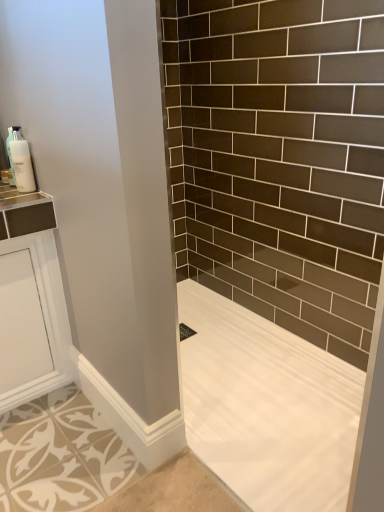
Question: Is white glossy soap dispenser at upper left located within white smooth bathtub at lower right?

Choices:
 (A) no
 (B) yes

Answer: (A)

Question: Is white smooth bathtub at lower right further to the viewer compared to white glossy soap dispenser at upper left?

Choices:
 (A) no
 (B) yes

Answer: (A)

Question: Can you confirm if white smooth bathtub at lower right is taller than white glossy soap dispenser at upper left?

Choices:
 (A) yes
 (B) no

Answer: (B)

Question: Is white smooth bathtub at lower right facing towards white glossy soap dispenser at upper left?

Choices:
 (A) no
 (B) yes

Answer: (A)

Question: From a real-world perspective, is white smooth bathtub at lower right below white glossy soap dispenser at upper left?

Choices:
 (A) yes
 (B) no

Answer: (A)

Question: Is white smooth bathtub at lower right oriented away from white glossy soap dispenser at upper left?

Choices:
 (A) no
 (B) yes

Answer: (A)

Question: Does white glossy soap dispenser at upper left touch white smooth bathtub at lower right?

Choices:
 (A) yes
 (B) no

Answer: (B)

Question: Does white glossy soap dispenser at upper left come in front of white smooth bathtub at lower right?

Choices:
 (A) no
 (B) yes

Answer: (A)

Question: From a real-world perspective, is white glossy soap dispenser at upper left over white smooth bathtub at lower right?

Choices:
 (A) yes
 (B) no

Answer: (A)

Question: Considering the relative sizes of white glossy soap dispenser at upper left and white smooth bathtub at lower right in the image provided, is white glossy soap dispenser at upper left thinner than white smooth bathtub at lower right?

Choices:
 (A) no
 (B) yes

Answer: (B)

Question: Is white glossy soap dispenser at upper left outside of white smooth bathtub at lower right?

Choices:
 (A) yes
 (B) no

Answer: (A)

Question: Is white glossy soap dispenser at upper left taller than white smooth bathtub at lower right?

Choices:
 (A) yes
 (B) no

Answer: (A)

Question: From a real-world perspective, is white glossy soap dispenser at upper left positioned above or below white smooth bathtub at lower right?

Choices:
 (A) above
 (B) below

Answer: (A)